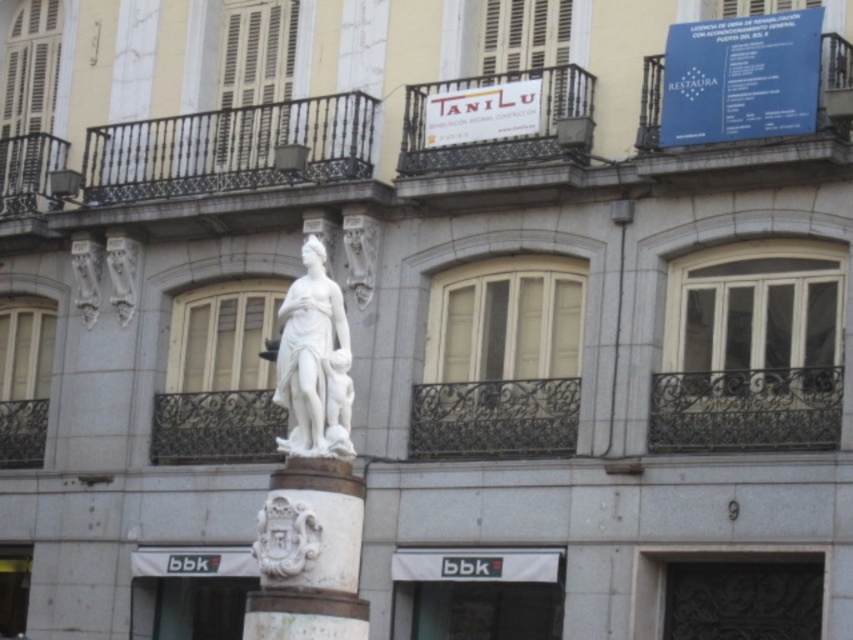
You are an architect designing a new plaza and want to place a decorative element between the white stone column at center and the white marble statue at center. Given their widths, which object should you place closer to the entrance to ensure the decorative element fits better?

The white stone column at center has a larger width than the white marble statue at center, so placing the decorative element closer to the entrance near the statue would allow better fitting since the statue is narrower.

You are standing in front of the building and want to determine which of the two points, point (302, 525) or point (349, 452), is nearer to you. Based on the scene, which point is closer?

Point (302, 525) is closer to the viewer than point (349, 452).